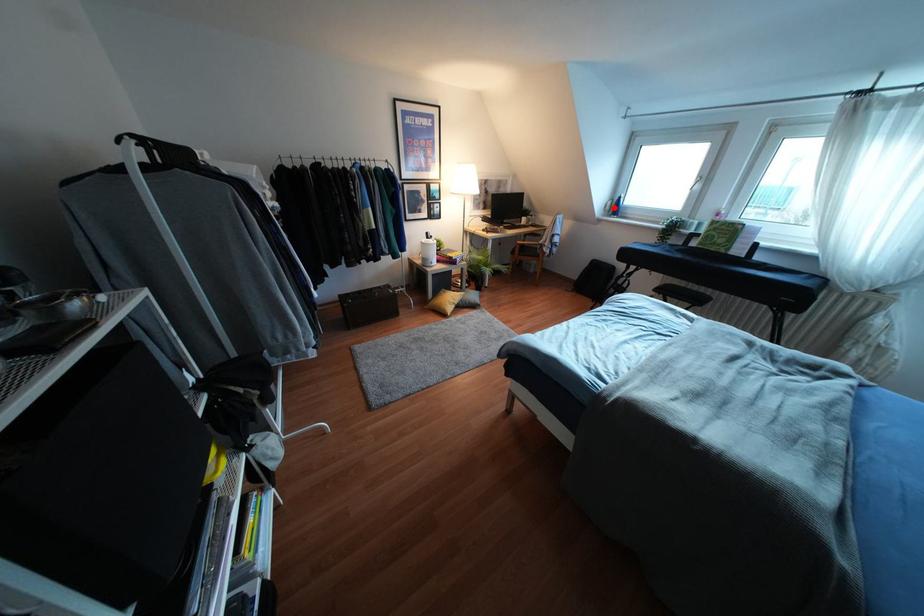
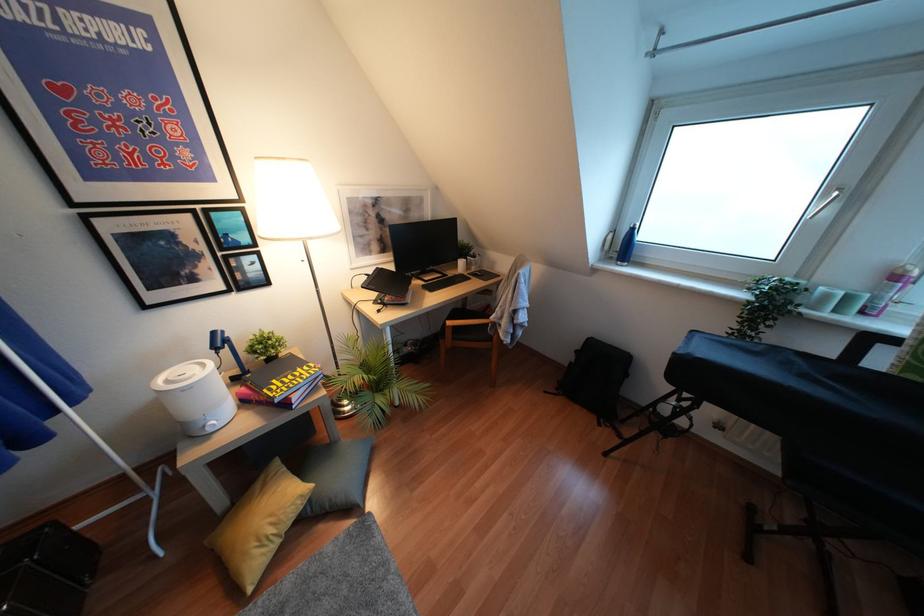
Question: I am providing you with two images of the same scene from different viewpoints. A red point is marked on the first image. Is the red point's position out of view in image 2?

Choices:
 (A) Yes
 (B) No

Answer: (B)